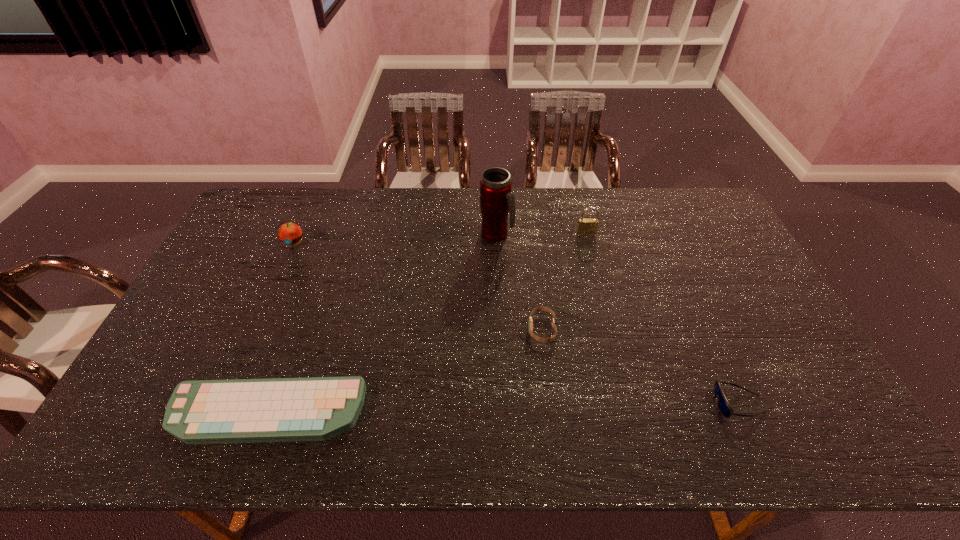
You are a GUI agent. You are given a task and a screenshot of the screen. Output one action in this format:
    pyautogui.click(x=<x>, y=<y>)
    Task: Click on the vacant space in between the sunglasses and the shortest object
    
    Given the screenshot: What is the action you would take?
    pyautogui.click(x=502, y=408)

The width and height of the screenshot is (960, 540). I want to click on free spot between the tallest object and the rightmost object, so (617, 319).

The image size is (960, 540). Identify the location of unoccupied position between the third nearest object and the rightmost object. (640, 366).

The image size is (960, 540). Find the location of `free space between the fifth shortest object and the computer keyboard`. free space between the fifth shortest object and the computer keyboard is located at coordinates (426, 322).

The height and width of the screenshot is (540, 960). I want to click on free space between the fifth object from left to right and the apple, so click(440, 238).

This screenshot has width=960, height=540. I want to click on free space between the apple and the second object from right to left, so click(x=440, y=238).

The image size is (960, 540). I want to click on empty location between the rightmost object and the tallest object, so click(x=617, y=319).

Image resolution: width=960 pixels, height=540 pixels. Find the location of `free point between the watch and the thermos bottle`. free point between the watch and the thermos bottle is located at coordinates (519, 282).

Identify the location of vacant region between the second tallest object and the tallest object. The height and width of the screenshot is (540, 960). (541, 234).

Locate an element on the screen. Image resolution: width=960 pixels, height=540 pixels. free space that is in between the sunglasses and the apple is located at coordinates (516, 323).